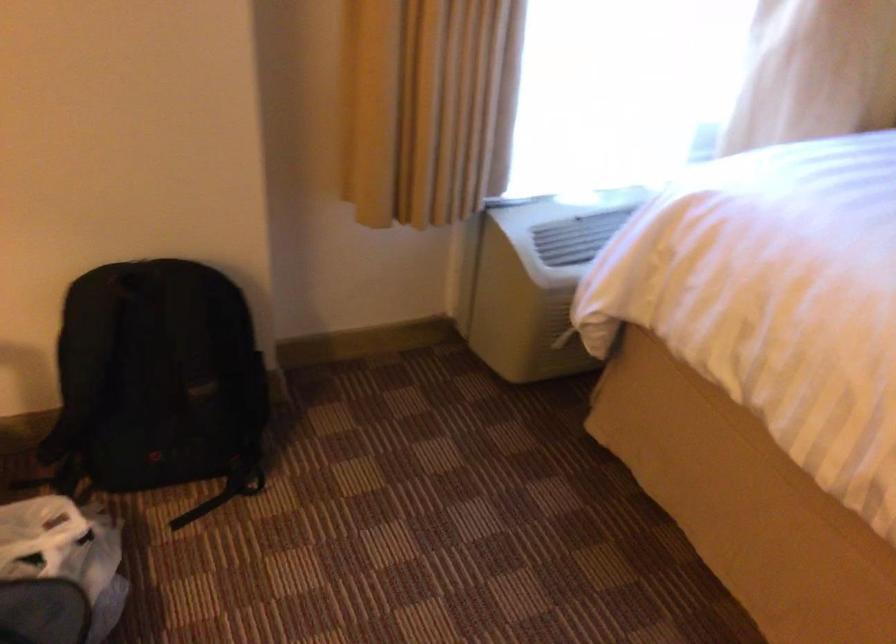
Identify the location of black backpack handle. (135, 281).